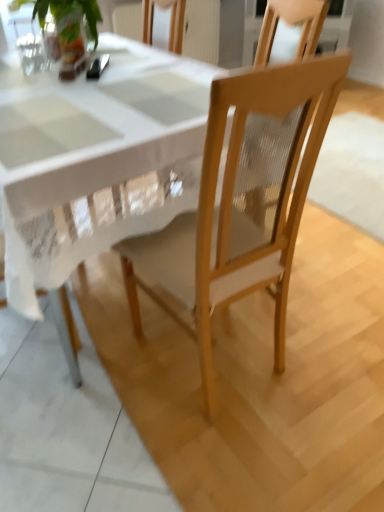
You are a GUI agent. You are given a task and a screenshot of the screen. Output one action in this format:
    pyautogui.click(x=<x>, y=<y>)
    Task: Click on the vacant area that is situated to the right of light wood chair at center
    
    Given the screenshot: What is the action you would take?
    pyautogui.click(x=327, y=349)